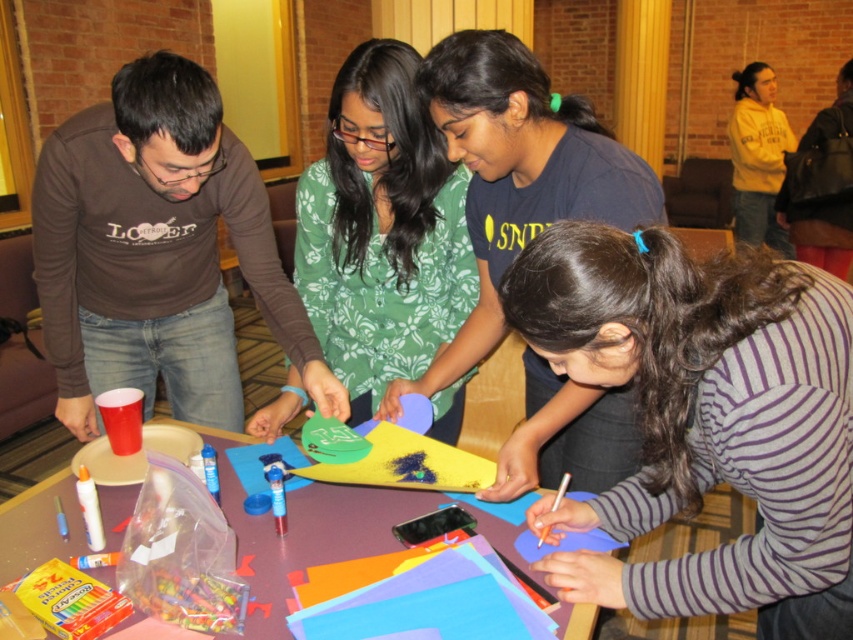
You are a photographer setting up a shoot in the room. You need to position a light source so that it illuminates both the green floral shirt at center and the matte plastic table at center. Considering their heights, which object should be placed closer to the light source to ensure both are well lit?

The green floral shirt at center is much taller than the matte plastic table at center, so the matte plastic table at center should be placed closer to the light source to ensure both receive adequate lighting.

You are standing at the origin point in the image. Where is the matte blue shirt at center located in terms of coordinates?

The matte blue shirt at center is located at coordinates point [517,173].